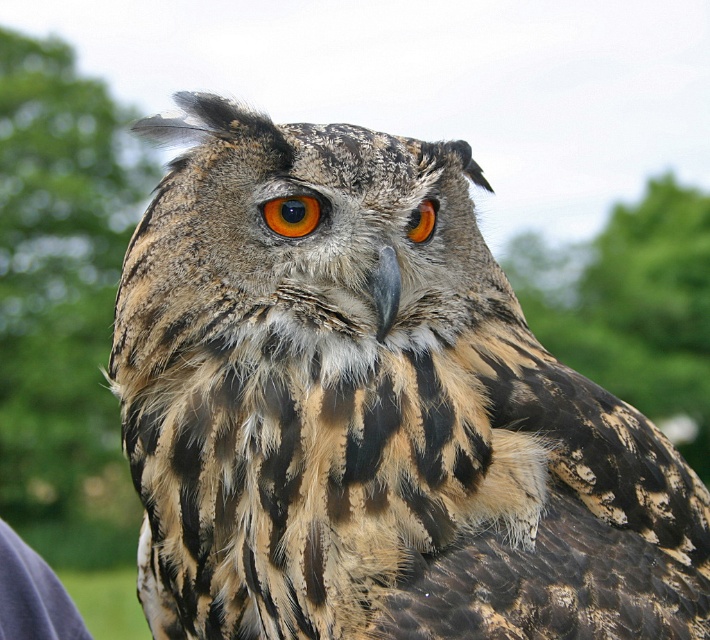
Which is more to the right, brown speckled owl at center or brown textured feathers at upper right?

From the viewer's perspective, brown textured feathers at upper right appears more on the right side.

Looking at this image, does brown speckled owl at center have a greater width compared to brown textured feathers at upper right?

No, brown speckled owl at center is not wider than brown textured feathers at upper right.

Between point (532, 433) and point (551, 342), which one is positioned behind?

Positioned behind is point (551, 342).

Locate an element on the screen. This screenshot has height=640, width=710. brown speckled owl at center is located at coordinates (371, 413).

Does orange-brown textured eye at center have a greater width compared to brown textured eye at center?

Yes, orange-brown textured eye at center is wider than brown textured eye at center.

Is orange-brown textured eye at center to the left of brown textured eye at center from the viewer's perspective?

Indeed, orange-brown textured eye at center is positioned on the left side of brown textured eye at center.

The height and width of the screenshot is (640, 710). Identify the location of orange-brown textured eye at center. [290, 214].

The image size is (710, 640). In order to click on orange-brown textured eye at center in this screenshot , I will do `click(290, 214)`.

Between point (1, 134) and point (278, 227), which one is positioned in front?

Point (278, 227) is in front.

Can you confirm if green leafy tree at upper left is taller than orange-brown textured eye at center?

Correct, green leafy tree at upper left is much taller as orange-brown textured eye at center.

Who is more distant from viewer, (136,212) or (290,200)?

The point (136,212) is behind.

Where is `green leafy tree at upper left`? The width and height of the screenshot is (710, 640). green leafy tree at upper left is located at coordinates (60, 282).